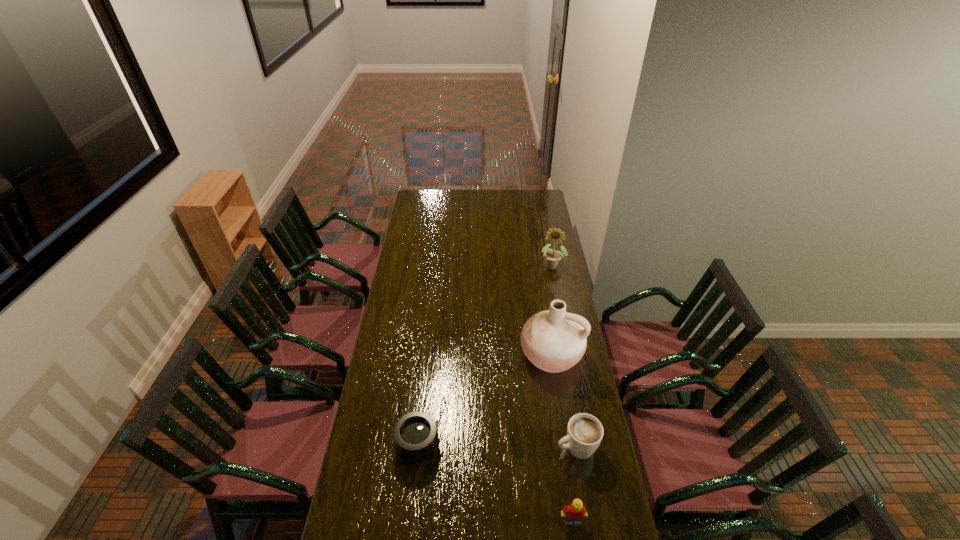
The height and width of the screenshot is (540, 960). In order to click on sunflower positioned at the right edge in this screenshot , I will do `click(552, 257)`.

Find the location of a particular element. Image resolution: width=960 pixels, height=540 pixels. pottery that is at the right edge is located at coordinates (554, 340).

Find the location of a particular element. The width and height of the screenshot is (960, 540). object located in the near right corner section of the desktop is located at coordinates (573, 514).

In the image, there is a desktop. Where is `vacant space at the far edge`? The image size is (960, 540). vacant space at the far edge is located at coordinates tap(499, 201).

In the image, there is a desktop. Identify the location of free space at the near edge. (400, 539).

This screenshot has height=540, width=960. In order to click on vacant space at the left edge in this screenshot , I will do `click(413, 214)`.

Identify the location of vacant region at the right edge. The height and width of the screenshot is (540, 960). (564, 380).

This screenshot has width=960, height=540. Find the location of `free space at the far right corner of the desktop`. free space at the far right corner of the desktop is located at coordinates (528, 195).

At what (x,y) coordinates should I click in order to perform the action: click on free space that is in between the cappuccino and the fourth nearest object. Please return your answer as a coordinate pair (x, y). Looking at the image, I should click on (564, 401).

The width and height of the screenshot is (960, 540). In order to click on empty location between the leftmost object and the cappuccino in this screenshot , I will do `click(497, 446)`.